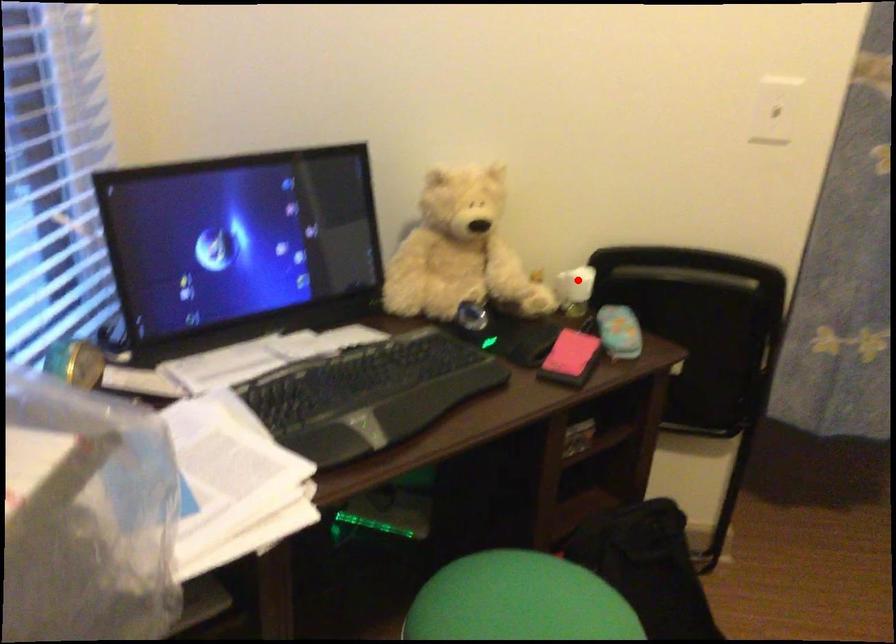
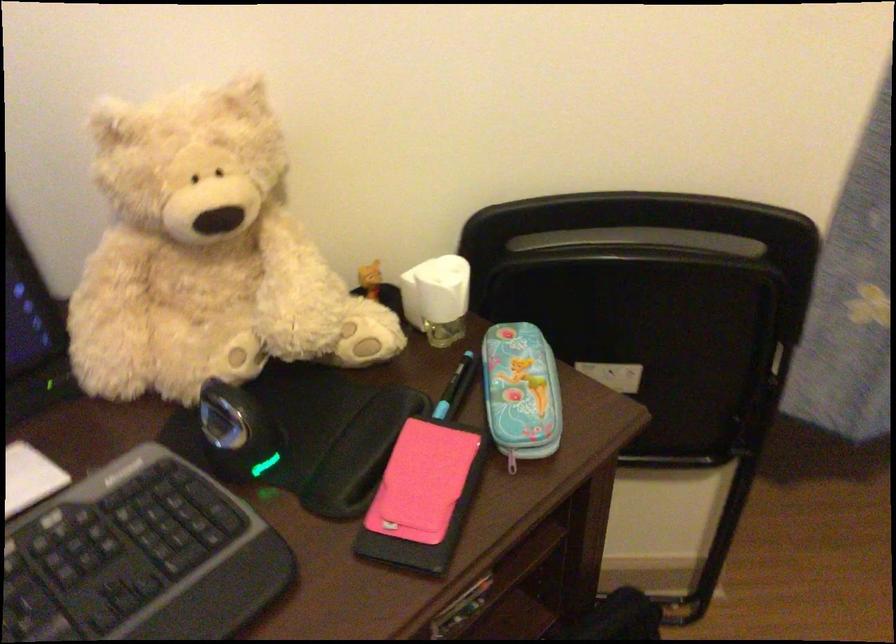
Where in the second image is the point corresponding to the highlighted location from the first image?

(437, 298)